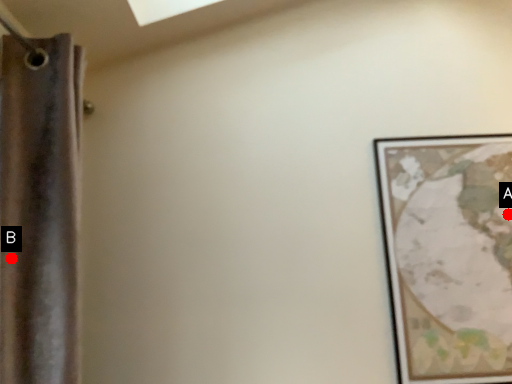
Question: Two points are circled on the image, labeled by A and B beside each circle. Which point is closer to the camera taking this photo?

Choices:
 (A) A is closer
 (B) B is closer

Answer: (B)